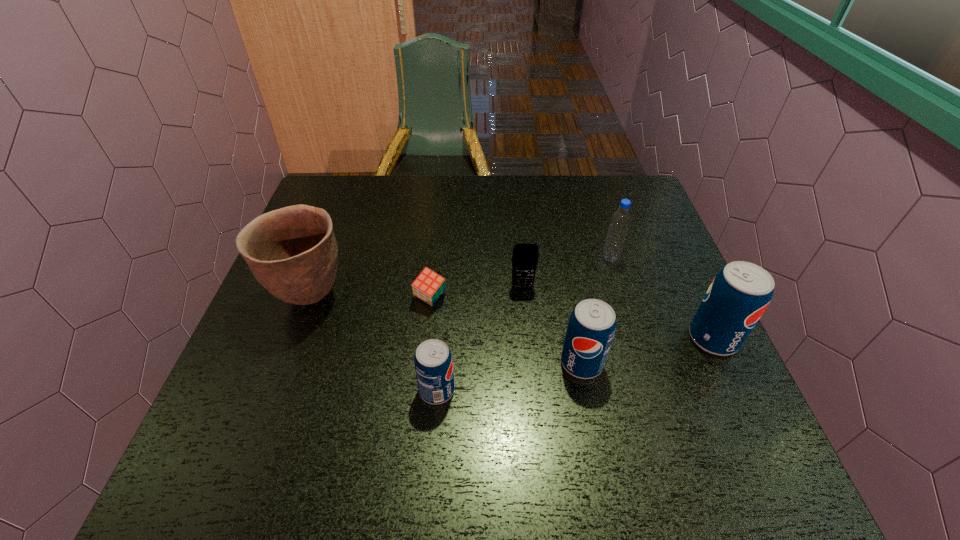
I want to click on vacant space located on the right of the leftmost pop, so click(567, 390).

Image resolution: width=960 pixels, height=540 pixels. I want to click on vacant space located 0.070m on the right of the second pop from left to right, so click(636, 363).

At what (x,y) coordinates should I click in order to perform the action: click on vacant space situated 0.310m on the left of the rightmost pop. Please return your answer as a coordinate pair (x, y). The height and width of the screenshot is (540, 960). Looking at the image, I should click on (551, 339).

Image resolution: width=960 pixels, height=540 pixels. Identify the location of free location located 0.140m on the screen of the cellular telephone. (527, 336).

This screenshot has height=540, width=960. In order to click on free space located 0.310m on the right of the pottery in this screenshot , I will do `click(478, 296)`.

Image resolution: width=960 pixels, height=540 pixels. In order to click on blank space located on the right of the cube in this screenshot , I will do [509, 298].

Identify the location of free space located on the front of the sixth object from left to right. (639, 352).

Find the location of a particular element. object that is positioned at the near edge is located at coordinates (433, 362).

Image resolution: width=960 pixels, height=540 pixels. In order to click on object present at the left edge in this screenshot , I will do `click(292, 252)`.

Find the location of `pop that is at the right edge`. pop that is at the right edge is located at coordinates (739, 294).